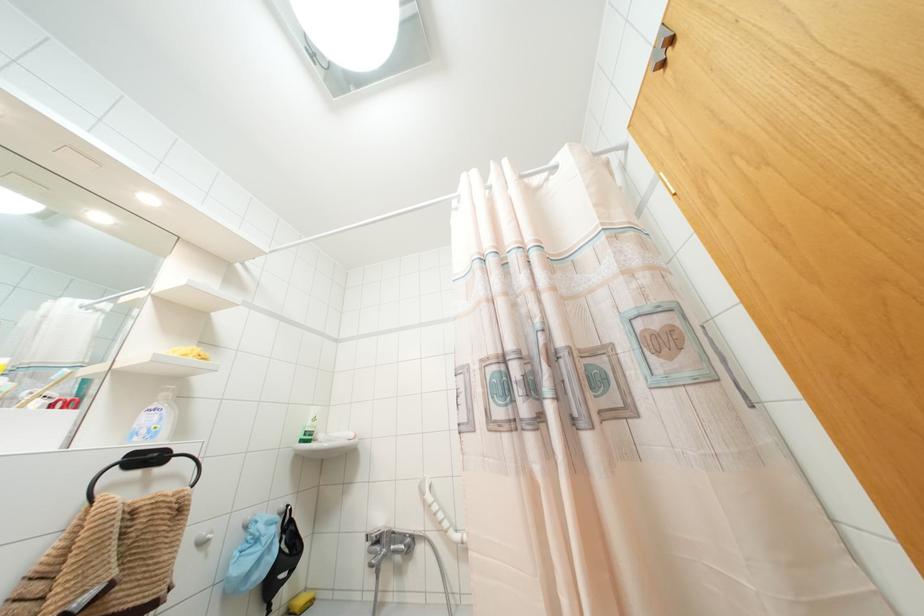
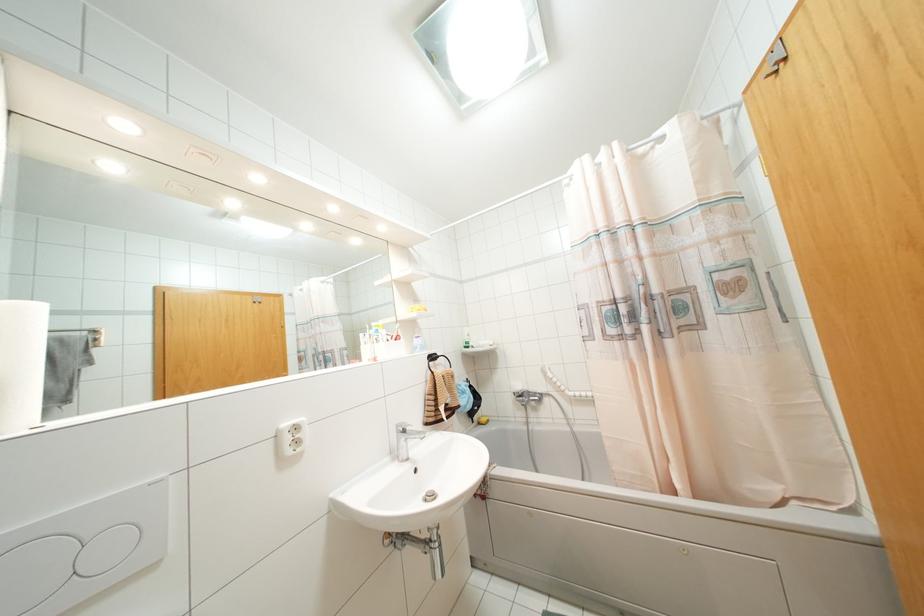
The point at [374,554] is marked in the first image. Where is the corresponding point in the second image?

(523, 400)